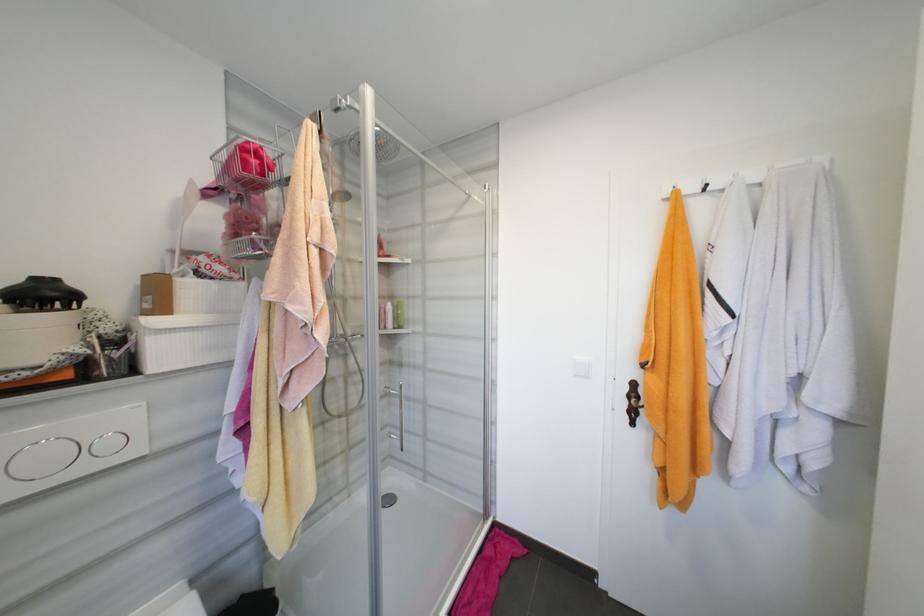
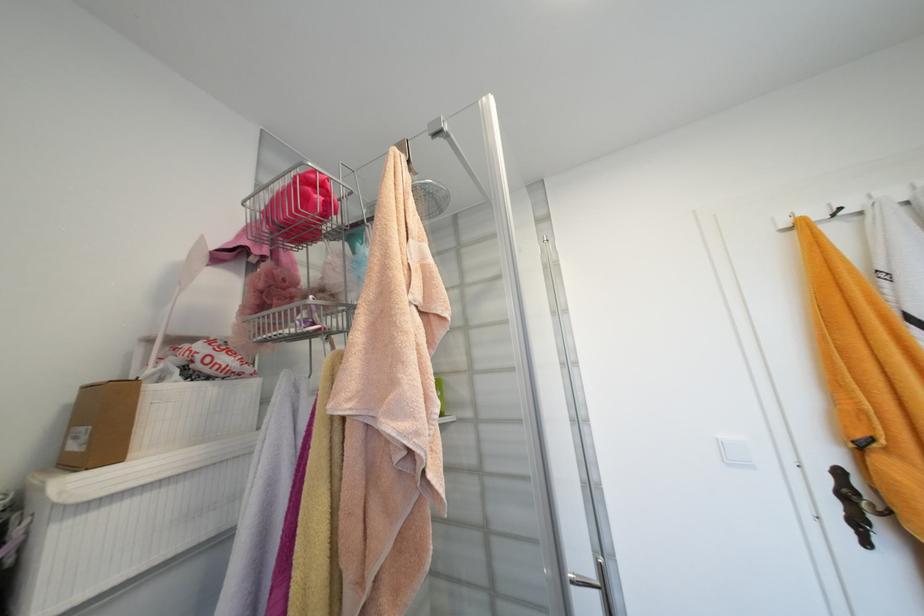
Where in the second image is the point corresponding to point (249, 151) from the first image?

(312, 182)